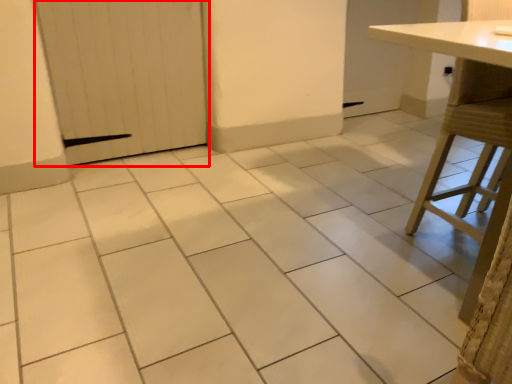
Question: From the image's perspective, where is door (annotated by the red box) located in relation to table in the image?

Choices:
 (A) below
 (B) above

Answer: (B)